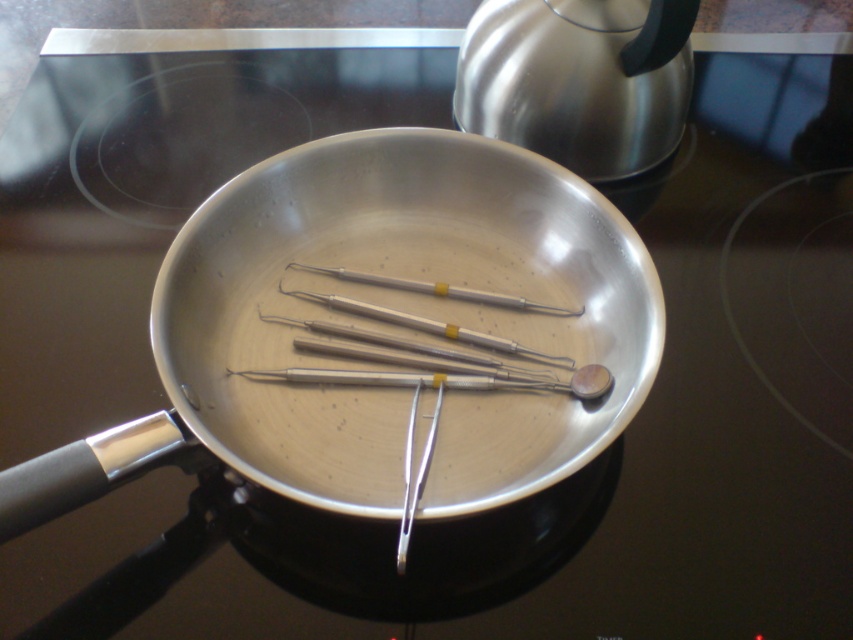
Question: Among these objects, which one is nearest to the camera?

Choices:
 (A) brushed metal teapot at upper right
 (B) satin silver metal probe at center

Answer: (B)

Question: Does brushed metal teapot at upper right appear on the right side of satin silver metal probe at center?

Choices:
 (A) yes
 (B) no

Answer: (A)

Question: Which object appears farthest from the camera in this image?

Choices:
 (A) satin silver metal probe at center
 (B) brushed metal teapot at upper right

Answer: (B)

Question: Observing the image, what is the correct spatial positioning of brushed metal teapot at upper right in reference to satin silver metal probe at center?

Choices:
 (A) right
 (B) left

Answer: (A)

Question: Does brushed metal teapot at upper right come behind satin silver metal probe at center?

Choices:
 (A) no
 (B) yes

Answer: (B)